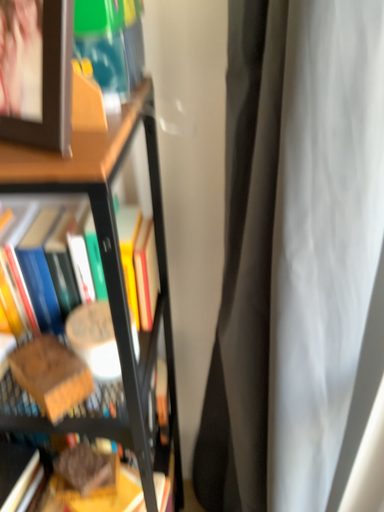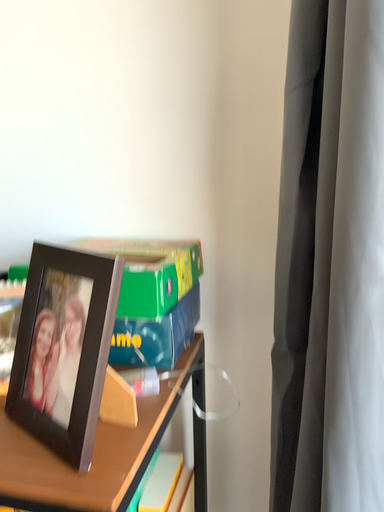
Question: Which way did the camera rotate in the video?

Choices:
 (A) rotated left
 (B) rotated right

Answer: (A)